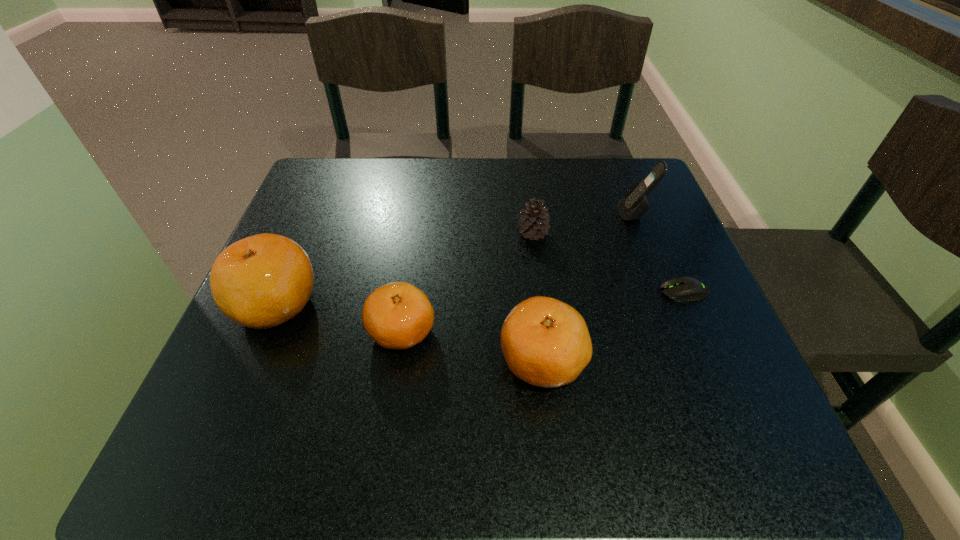
Where is `the leftmost object`? the leftmost object is located at coordinates 262,281.

Where is `the fifth object from right to left`? Image resolution: width=960 pixels, height=540 pixels. the fifth object from right to left is located at coordinates (398, 315).

This screenshot has width=960, height=540. What are the coordinates of `the shortest clementine` in the screenshot? It's located at coord(398,315).

Where is `the rightmost clementine`? This screenshot has width=960, height=540. the rightmost clementine is located at coordinates (545, 342).

Locate an element on the screen. This screenshot has height=540, width=960. the third tallest object is located at coordinates (545, 342).

The width and height of the screenshot is (960, 540). In order to click on the shortest object in this screenshot , I will do `click(684, 288)`.

This screenshot has height=540, width=960. I want to click on cellular telephone, so click(634, 204).

Identify the location of pinecone. (533, 222).

At what (x,y) coordinates should I click in order to perform the action: click on free space located on the back of the leftmost clementine. Please return your answer as a coordinate pair (x, y). Looking at the image, I should click on (326, 186).

Identify the location of vacant region located 0.360m on the back of the second clementine from left to right. The height and width of the screenshot is (540, 960). (422, 195).